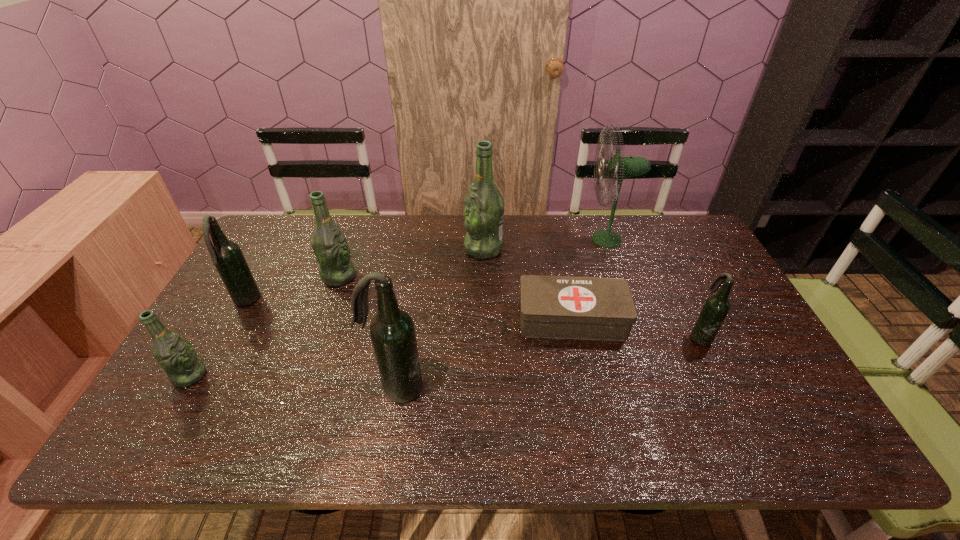
Locate an element on the screen. This screenshot has width=960, height=540. vacant position at the near edge of the desktop is located at coordinates (250, 426).

Where is `vacant space at the right edge of the desktop`? vacant space at the right edge of the desktop is located at coordinates (700, 287).

Where is `vacant space at the far right corner of the desktop`? This screenshot has height=540, width=960. vacant space at the far right corner of the desktop is located at coordinates (693, 233).

The width and height of the screenshot is (960, 540). I want to click on unoccupied position between the second dark beer bottle from right to left and the second nearest dark beer bottle, so click(548, 362).

At what (x,y) coordinates should I click in order to perform the action: click on vacant area that lies between the sixth nearest object and the biggest green beer bottle. Please return your answer as a coordinate pair (x, y). This screenshot has height=540, width=960. Looking at the image, I should click on (412, 262).

At what (x,y) coordinates should I click in order to perform the action: click on vacant point located between the first-aid kit and the rightmost object. Please return your answer as a coordinate pair (x, y). The width and height of the screenshot is (960, 540). Looking at the image, I should click on (636, 327).

Find the location of a particular element. vacant space in between the second green beer bottle from right to left and the first-aid kit is located at coordinates (455, 298).

Where is `empty space between the sixth nearest object and the second beer bottle from right to left`? This screenshot has width=960, height=540. empty space between the sixth nearest object and the second beer bottle from right to left is located at coordinates (412, 262).

Where is `unoccupied position between the second biggest dark beer bottle and the shortest object`? The width and height of the screenshot is (960, 540). unoccupied position between the second biggest dark beer bottle and the shortest object is located at coordinates (409, 310).

Find the location of a particular element. vacant space in between the farthest dark beer bottle and the fifth beer bottle from left to right is located at coordinates (365, 275).